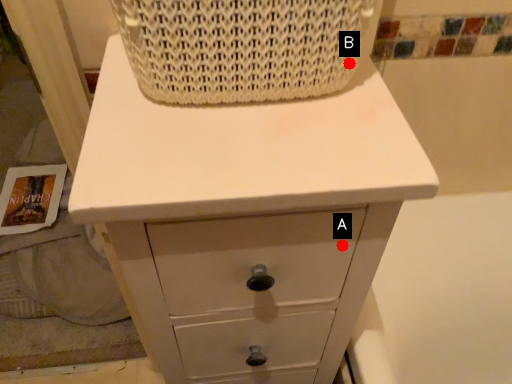
Question: Two points are circled on the image, labeled by A and B beside each circle. Which of the following is the closest to the observer?

Choices:
 (A) A is closer
 (B) B is closer

Answer: (B)